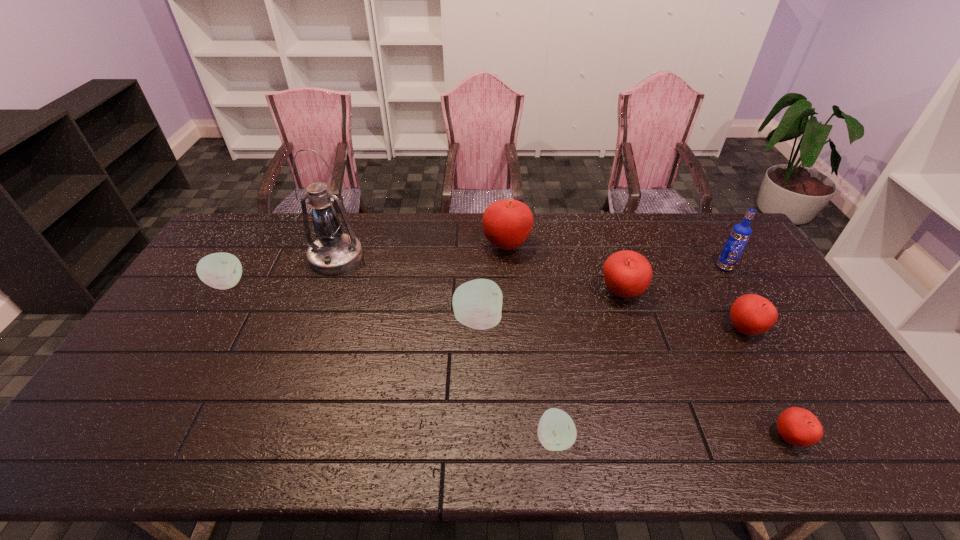
In order to click on vacant space at the far edge of the desktop in this screenshot , I will do `click(276, 238)`.

This screenshot has height=540, width=960. Find the location of `free space at the near edge`. free space at the near edge is located at coordinates (775, 448).

Find the location of `vacant region at the far left corner of the desktop`. vacant region at the far left corner of the desktop is located at coordinates (234, 238).

Locate an element on the screen. Image resolution: width=960 pixels, height=540 pixels. vacant region at the far right corner of the desktop is located at coordinates pyautogui.click(x=694, y=229).

This screenshot has height=540, width=960. Find the location of `unoccupied position between the third biggest red apple and the smallest white apple`. unoccupied position between the third biggest red apple and the smallest white apple is located at coordinates (650, 384).

Find the location of a particular element. This screenshot has width=960, height=540. free space between the second tallest object and the nearest white apple is located at coordinates (639, 353).

Find the location of a particular element. free point between the sixth object from left to right and the second white apple from left to right is located at coordinates 549,307.

Identify the location of unoccupied area between the nearest red apple and the tallest apple. This screenshot has width=960, height=540. (648, 341).

At what (x,y) coordinates should I click in order to perform the action: click on free area in between the biggest white apple and the vodka. Please return your answer as a coordinate pair (x, y). This screenshot has height=540, width=960. Looking at the image, I should click on (601, 294).

Identify the location of free spot between the oil lamp and the blue vodka. tap(530, 262).